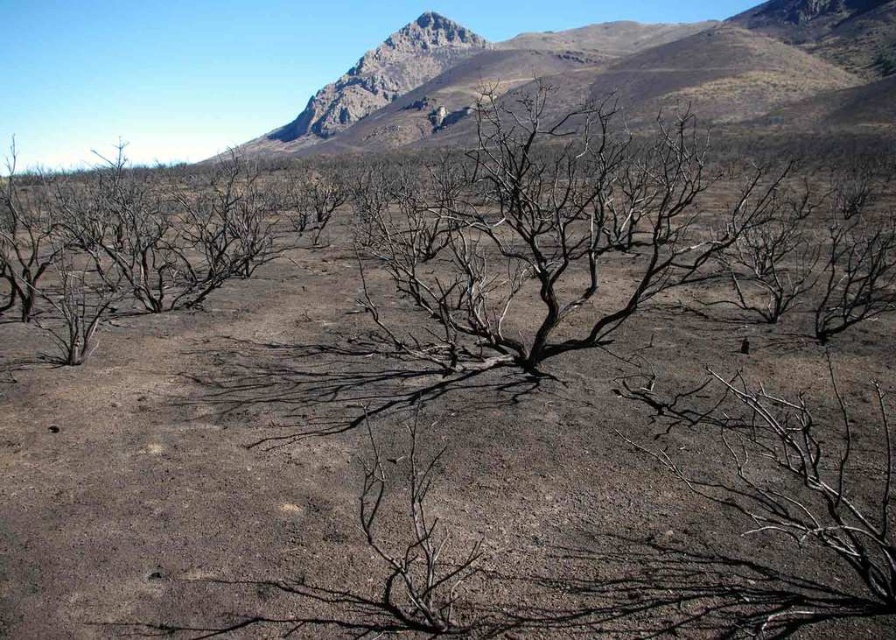
Is dark brown dirt field at center to the right of charred wood tree at center from the viewer's perspective?

No, dark brown dirt field at center is not to the right of charred wood tree at center.

Is dark brown dirt field at center taller than charred wood tree at center?

No.

This screenshot has height=640, width=896. Describe the element at coordinates (359, 477) in the screenshot. I see `dark brown dirt field at center` at that location.

The width and height of the screenshot is (896, 640). I want to click on dark brown dirt field at center, so click(x=359, y=477).